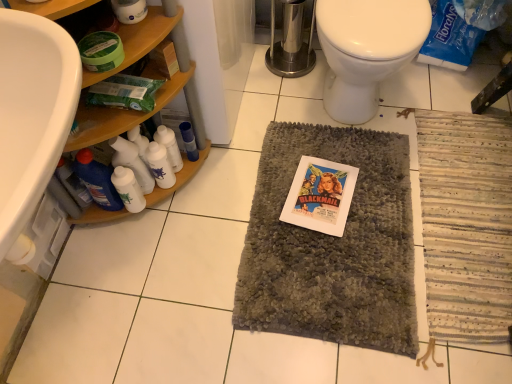
At what (x,y) coordinates should I click in order to perform the action: click on vacant area that lies between woodenshelves at left and gray shaggy mat at center. Please return your answer as a coordinate pair (x, y). The height and width of the screenshot is (384, 512). Looking at the image, I should click on (208, 224).